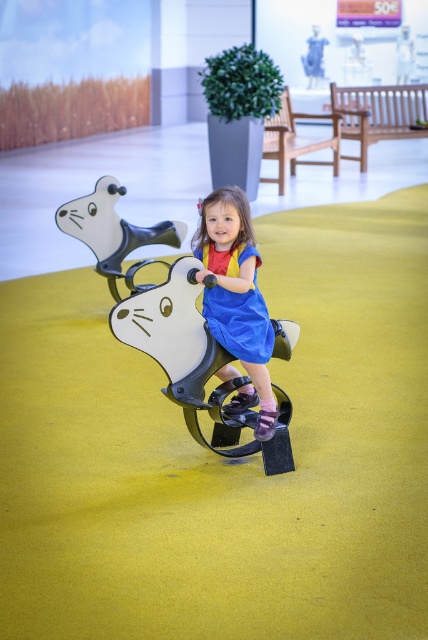
You are standing at the point marked as point (113,232). What object are you touching?

You are touching the metallic silver bear at center, as the point (113,232) is located on it.

You are a photographer trying to capture the blue cotton dress at center and the metallic silver bear at center in the same frame. Which object should you focus on first to ensure both are in focus?

You should focus on the blue cotton dress at center first because it is closer to the viewer than the metallic silver bear at center, so adjusting focus from near to far will help both be in focus.